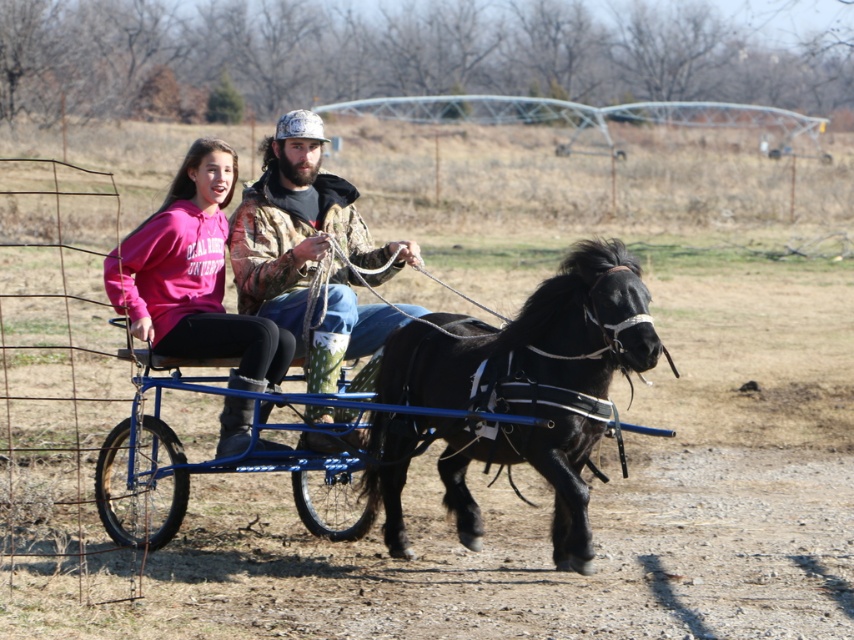
Looking at this image, who is more distant from viewer, [252,220] or [167,349]?

The point [252,220] is more distant.

Which is below, camouflage fabric shirt at center or pink fleece sweatshirt at center?

camouflage fabric shirt at center is lower down.

This screenshot has height=640, width=854. Describe the element at coordinates (313, 257) in the screenshot. I see `camouflage fabric shirt at center` at that location.

Locate an element on the screen. The image size is (854, 640). camouflage fabric shirt at center is located at coordinates (313, 257).

In order to click on black glossy horse at center in this screenshot , I will do coord(515,394).

Who is more distant from viewer, [589,442] or [179,461]?

Point [179,461]

What are the coordinates of `black glossy horse at center` in the screenshot? It's located at (515, 394).

Can you confirm if camouflage fabric shirt at center is positioned below blue metallic cart at center?

Incorrect, camouflage fabric shirt at center is not positioned below blue metallic cart at center.

Is camouflage fabric shirt at center thinner than blue metallic cart at center?

→ Yes.

Describe the element at coordinates (313, 257) in the screenshot. The width and height of the screenshot is (854, 640). I see `camouflage fabric shirt at center` at that location.

Find the location of a particular element. camouflage fabric shirt at center is located at coordinates (313, 257).